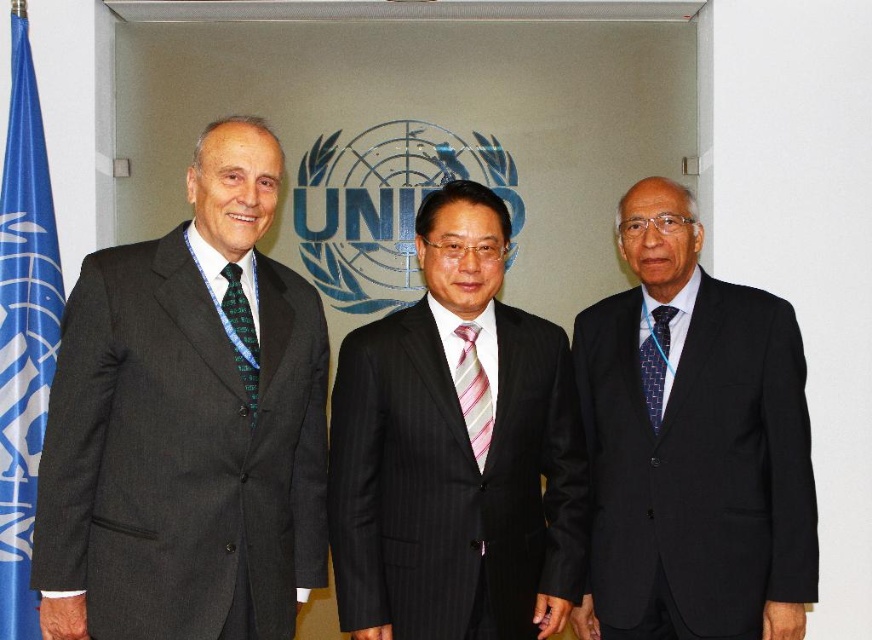
You are a photographer setting up for a group photo. You notice the matte black suit at left and the dark gray suit at right. Which suit is positioned closer to the camera?

The matte black suit at left is closer to the viewer than the dark gray suit at right, so the matte black suit at left is positioned closer to the camera.

From the picture: You are a photographer setting up for a group photo. You notice two men wearing the matte black suit at left and the dark gray suit at right. Based on their heights, which man should you position closer to the center to ensure both appear equally visible in the photo?

The matte black suit at left is shorter than the dark gray suit at right, so positioning the shorter man wearing the matte black suit at left closer to the center will help balance their visibility in the photo.

You are organizing a formal event and need to ensure all attendees have their ties properly aligned with the podium. The podium has a height of 1.2 meters. Given the pink striped tie at center and the blue textured tie at right, which tie will require adjustment to avoid obstruction during speeches?

The pink striped tie at center is much taller than the blue textured tie at right, so it will require adjustment to avoid obstruction during speeches.